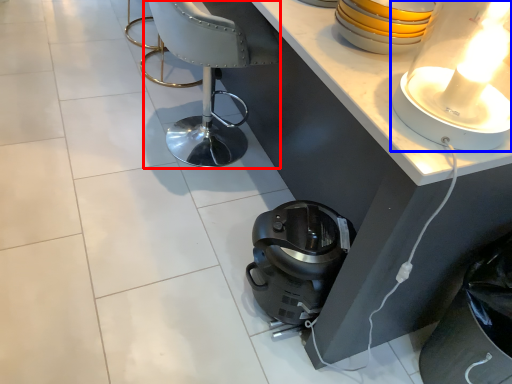
Question: Which object is closer to the camera taking this photo, armchair (highlighted by a red box) or lamp (highlighted by a blue box)?

Choices:
 (A) armchair
 (B) lamp

Answer: (B)